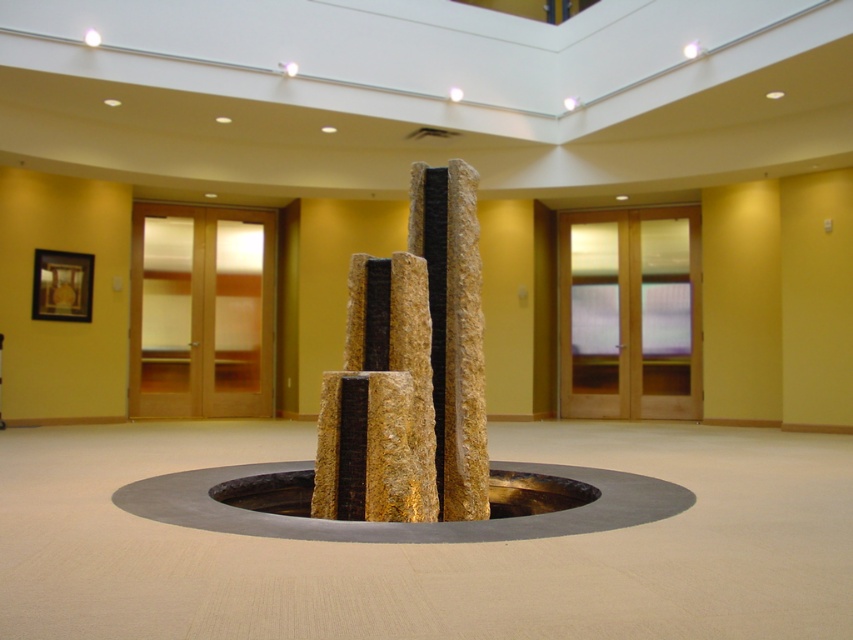
Question: Which point is farther to the camera?

Choices:
 (A) rusty metal manhole at center
 (B) metallic circular manhole at center

Answer: (A)

Question: From the image, what is the correct spatial relationship of golden textured stone at center in relation to rusty metal manhole at center?

Choices:
 (A) below
 (B) above

Answer: (B)

Question: Among these objects, which one is farthest from the camera?

Choices:
 (A) metallic circular manhole at center
 (B) rusty metal manhole at center
 (C) golden textured stone at center

Answer: (B)

Question: Can you confirm if golden textured stone at center is positioned to the right of rusty metal manhole at center?

Choices:
 (A) no
 (B) yes

Answer: (A)

Question: Which object is positioned farthest from the metallic circular manhole at center?

Choices:
 (A) golden textured stone at center
 (B) rusty metal manhole at center

Answer: (A)

Question: Does golden textured stone at center have a lesser width compared to rusty metal manhole at center?

Choices:
 (A) no
 (B) yes

Answer: (A)